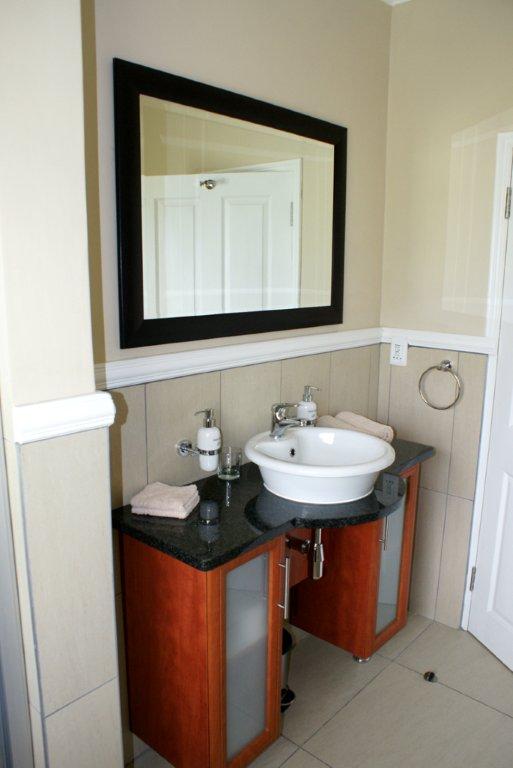
The height and width of the screenshot is (768, 513). Identify the location of frosted glass. (391, 548).